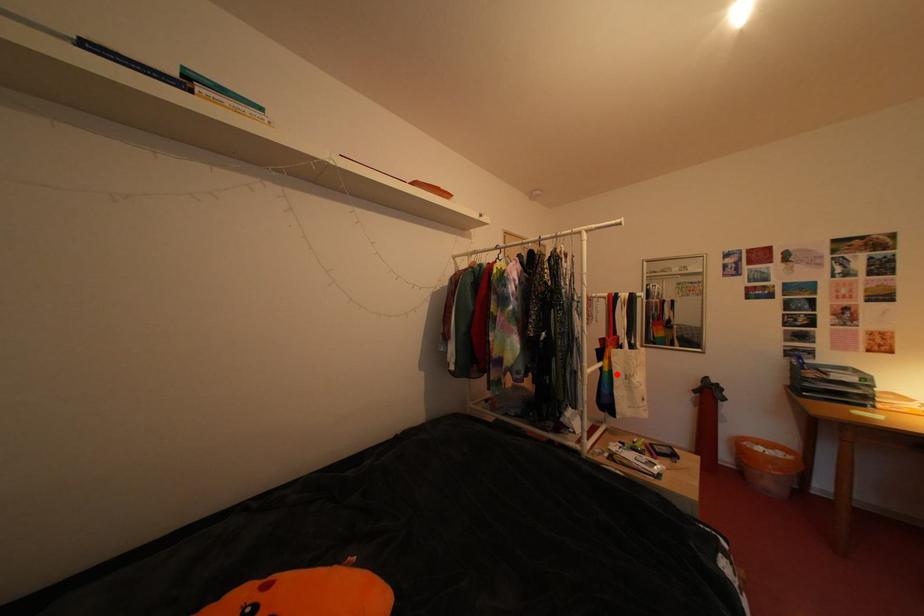
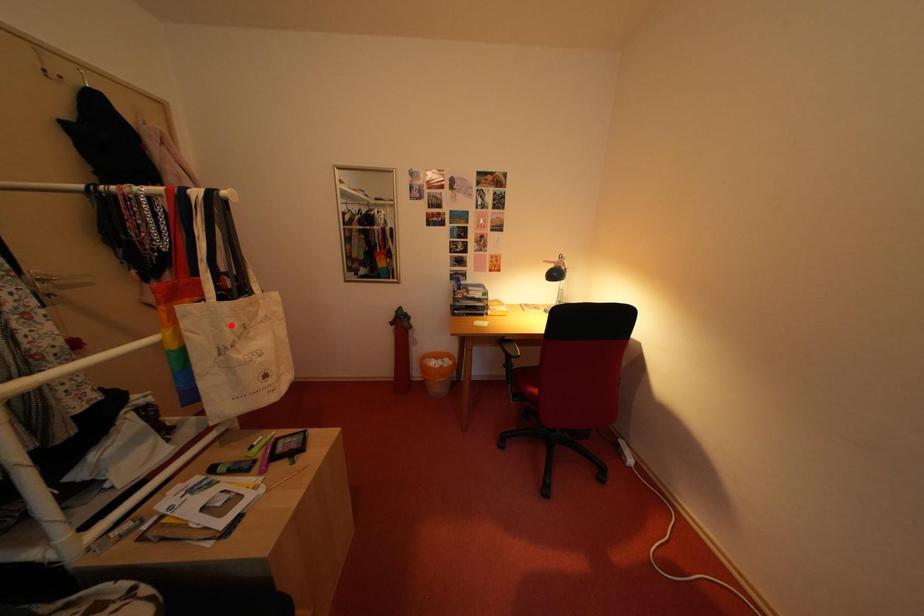
I am providing you with two images of the same scene from different viewpoints. A red point is marked on the first image and another point is marked on the second image. Is the red point in image1 aligned with the point shown in image2?

No